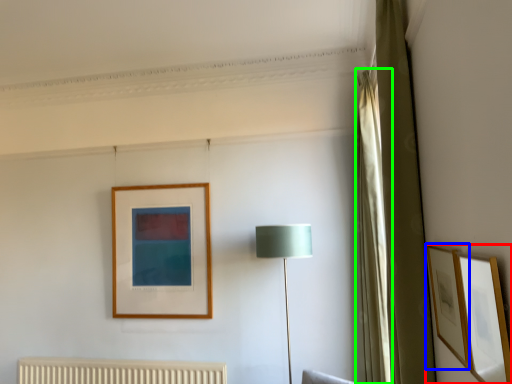
Question: Considering the real-world distances, which object is farthest from picture frame (highlighted by a red box)? picture frame (highlighted by a blue box) or curtain (highlighted by a green box)?

Choices:
 (A) picture frame
 (B) curtain

Answer: (B)